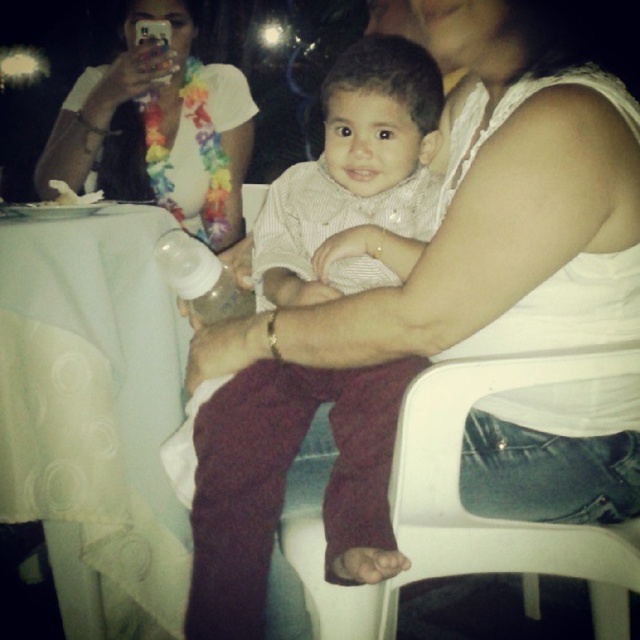
You are standing at the position of the camera and want to throw a small ball to a friend who is at point [192,273]. There is an obstacle at point [436,477]. Will the ball pass over the obstacle?

Point [436,477] is closer to the camera than point [192,273], so the ball will hit the obstacle at point [436,477] before reaching your friend.